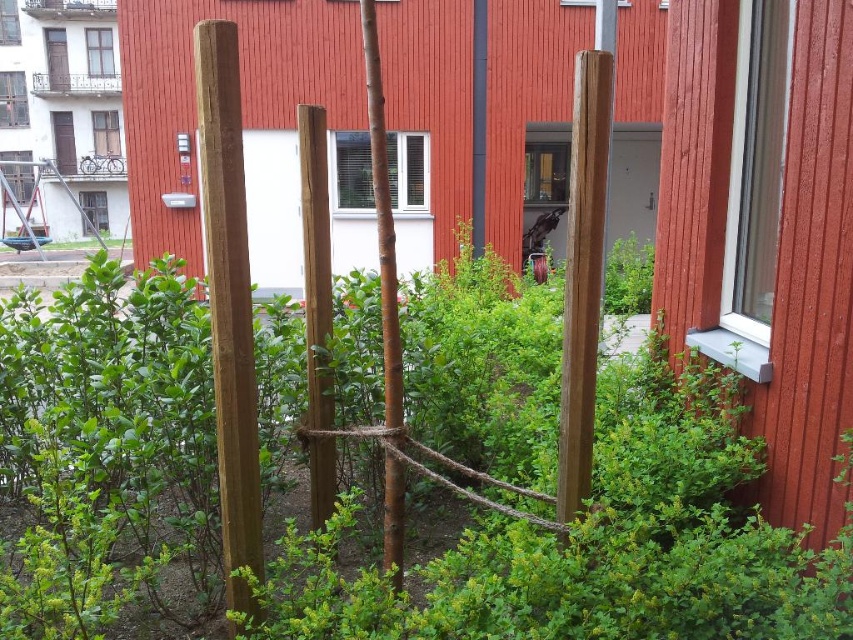
Is natural wood pole at center positioned at the back of smooth brown pole at center?

No, natural wood pole at center is in front of smooth brown pole at center.

Between natural wood pole at center and smooth brown pole at center, which one appears on the left side from the viewer's perspective?

From the viewer's perspective, natural wood pole at center appears more on the left side.

Is point (241, 198) positioned before point (570, 195)?

Yes, point (241, 198) is closer to viewer.

Locate an element on the screen. natural wood pole at center is located at coordinates coord(229,304).